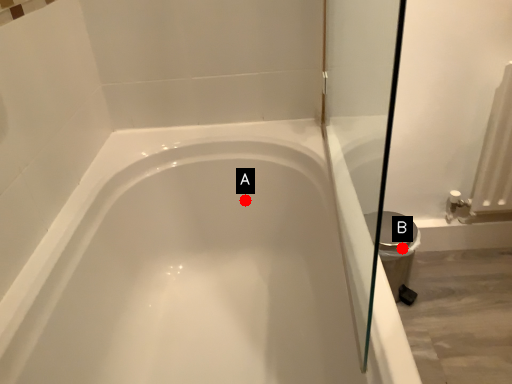
Question: Two points are circled on the image, labeled by A and B beside each circle. Which point is farther to the camera?

Choices:
 (A) A is further
 (B) B is further

Answer: (B)